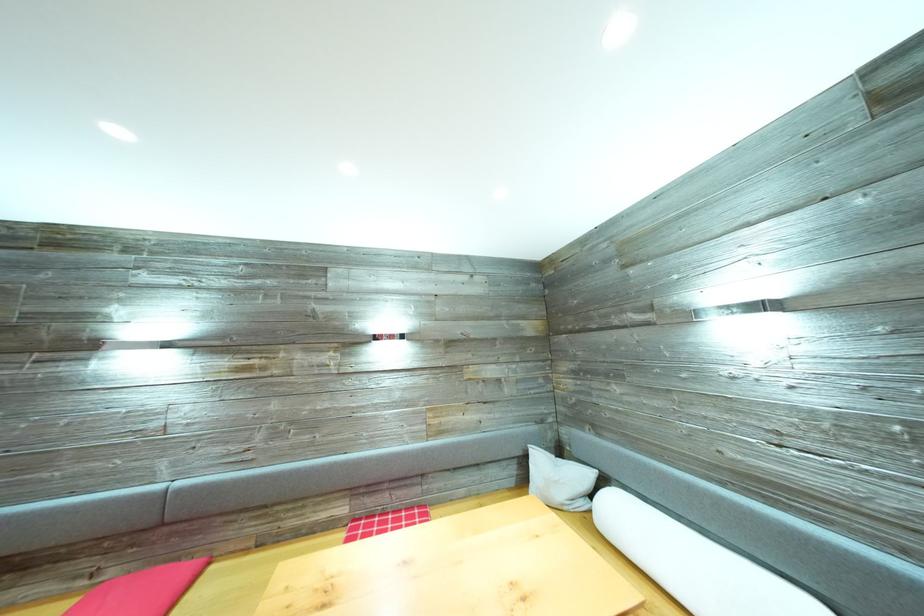
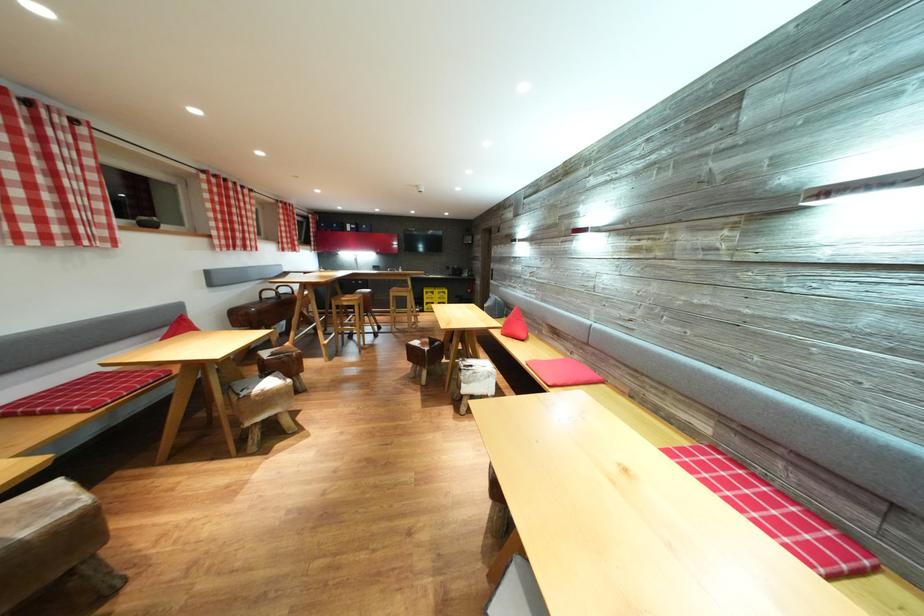
Question: Based on the continuous images, in which direction is the camera rotating? Reply with the corresponding letter.

Choices:
 (A) Left
 (B) Right
 (C) Up
 (D) Down

Answer: (A)